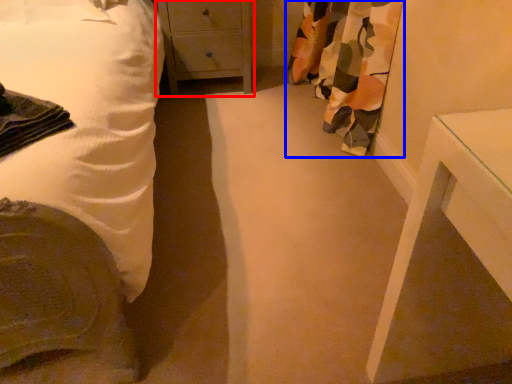
Question: Which of the following is the farthest to the observer, chest of drawers (highlighted by a red box) or curtain (highlighted by a blue box)?

Choices:
 (A) chest of drawers
 (B) curtain

Answer: (A)